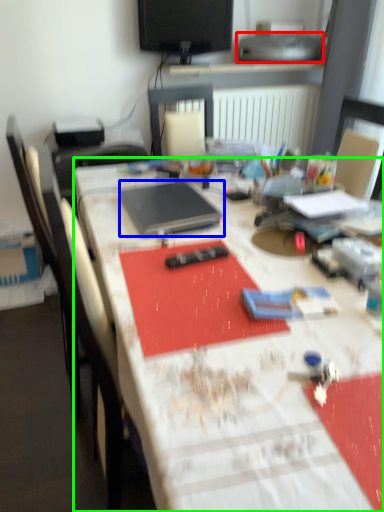
Question: Estimate the real-world distances between objects in this image. Which object is farther from printer (highlighted by a red box), laptop (highlighted by a blue box) or desk (highlighted by a green box)?

Choices:
 (A) laptop
 (B) desk

Answer: (B)